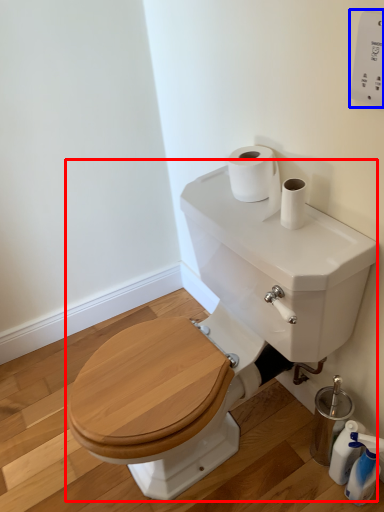
Question: Which of the following is the closest to the observer, sink (highlighted by a red box) or electric outlet (highlighted by a blue box)?

Choices:
 (A) sink
 (B) electric outlet

Answer: (A)